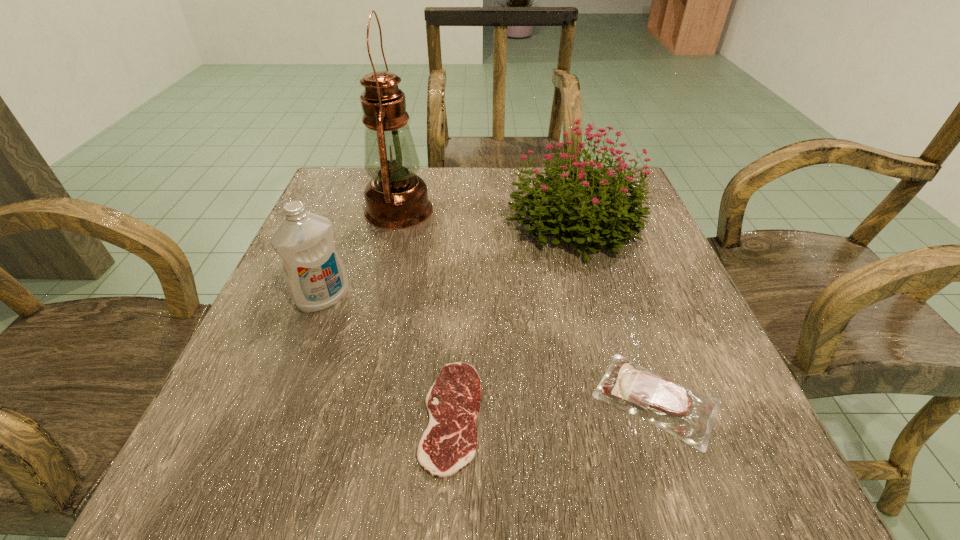
You are a GUI agent. You are given a task and a screenshot of the screen. Output one action in this format:
    pyautogui.click(x=<x>, y=<y>)
    Task: Click on the vacant space positioned on the left of the right steak
    The height and width of the screenshot is (540, 960).
    Given the screenshot: What is the action you would take?
    pyautogui.click(x=427, y=399)

This screenshot has height=540, width=960. I want to click on free space located 0.310m on the right of the shortest object, so click(703, 416).

Locate an element on the screen. The image size is (960, 540). oil lamp that is at the far edge is located at coordinates (396, 198).

Find the location of a particular element. Image resolution: width=960 pixels, height=540 pixels. bouquet that is at the far edge is located at coordinates (583, 215).

Find the location of a particular element. oil lamp positioned at the left edge is located at coordinates (396, 198).

The height and width of the screenshot is (540, 960). Find the location of `detergent present at the left edge`. detergent present at the left edge is located at coordinates (315, 276).

Where is `bouquet situated at the right edge`? bouquet situated at the right edge is located at coordinates (583, 215).

The height and width of the screenshot is (540, 960). Find the location of `steak that is at the right edge`. steak that is at the right edge is located at coordinates (663, 402).

This screenshot has height=540, width=960. In order to click on object that is at the far left corner in this screenshot , I will do `click(396, 198)`.

Find the location of a particular element. object that is at the far right corner is located at coordinates (583, 215).